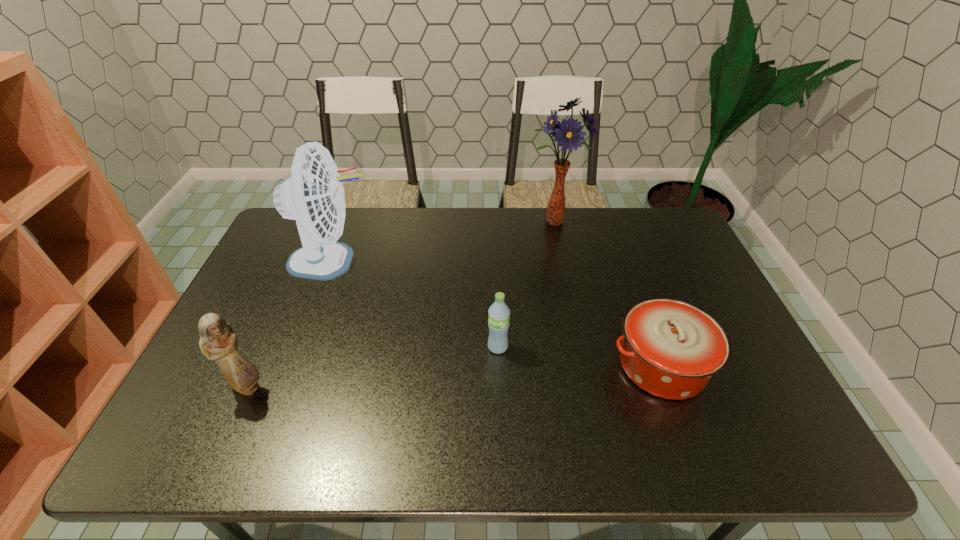
Locate an element on the screen. This screenshot has width=960, height=540. free space in the image that satisfies the following two spatial constraints: 1. on the grille of the water bottle; 2. on the right side of the fourth nearest object is located at coordinates pos(300,347).

Image resolution: width=960 pixels, height=540 pixels. What are the coordinates of `free space that satisfies the following two spatial constraints: 1. on the back side of the flower arrangement; 2. on the left side of the second shortest object` in the screenshot? It's located at (493, 222).

The height and width of the screenshot is (540, 960). Identify the location of blank space that satisfies the following two spatial constraints: 1. on the grille of the fourth nearest object; 2. on the right side of the fourth tallest object. (300, 347).

At what (x,y) coordinates should I click in order to perform the action: click on vacant region that satisfies the following two spatial constraints: 1. on the front side of the flower arrangement; 2. on the left side of the casserole. Please return your answer as a coordinate pair (x, y). The width and height of the screenshot is (960, 540). Looking at the image, I should click on (584, 366).

The image size is (960, 540). I want to click on free space in the image that satisfies the following two spatial constraints: 1. on the grille of the fan; 2. on the back side of the second shortest object, so click(x=300, y=347).